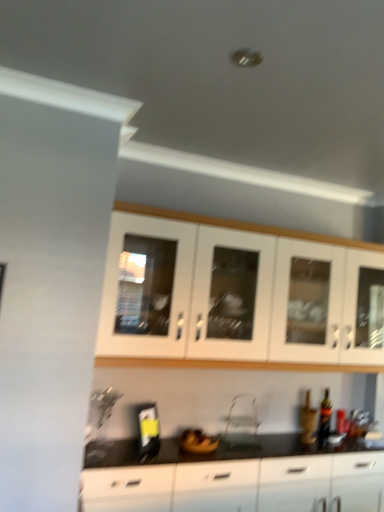
Identify the location of vacant space in front of clear plastic folding chair at center. The width and height of the screenshot is (384, 512). (252, 454).